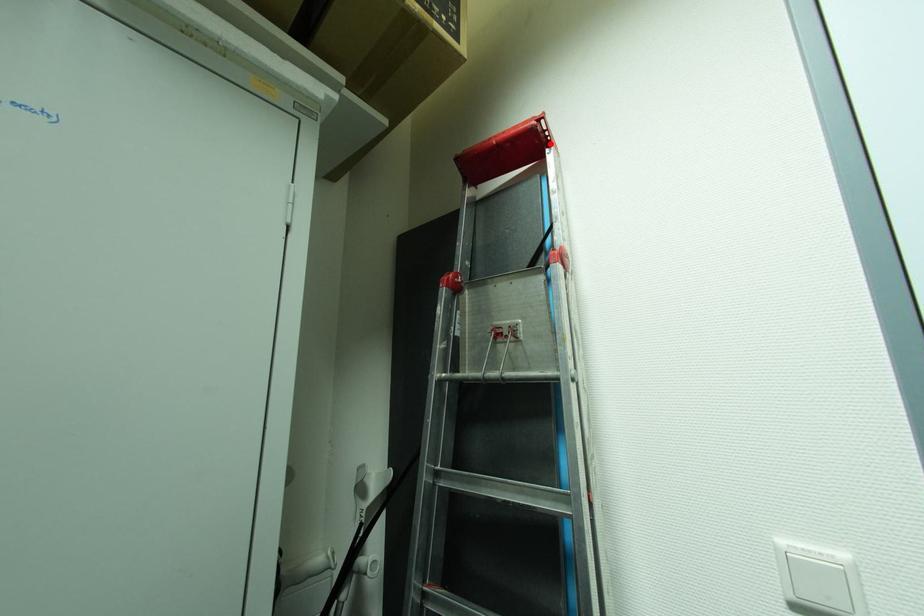
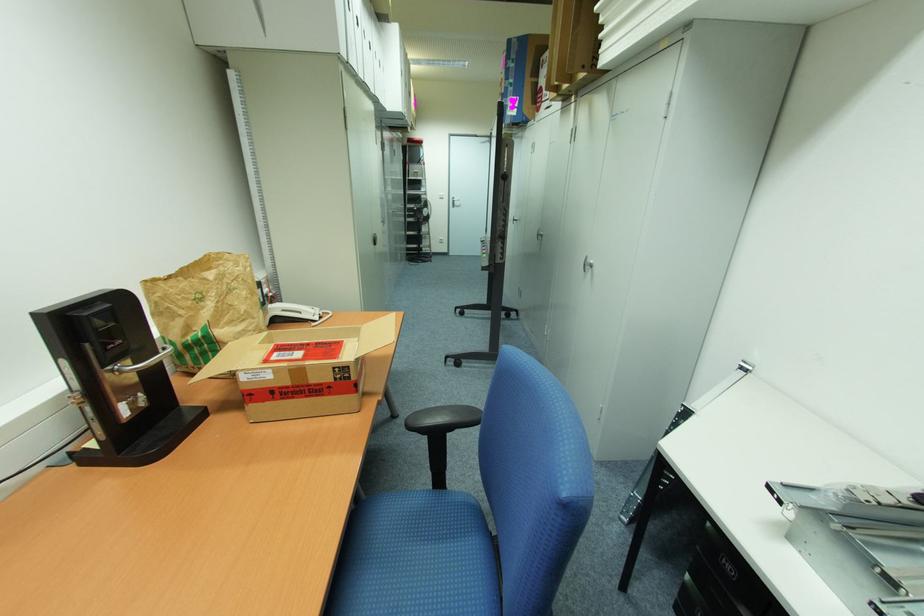
In the second image, find the point that corresponds to the highlighted location in the first image.

(423, 144)